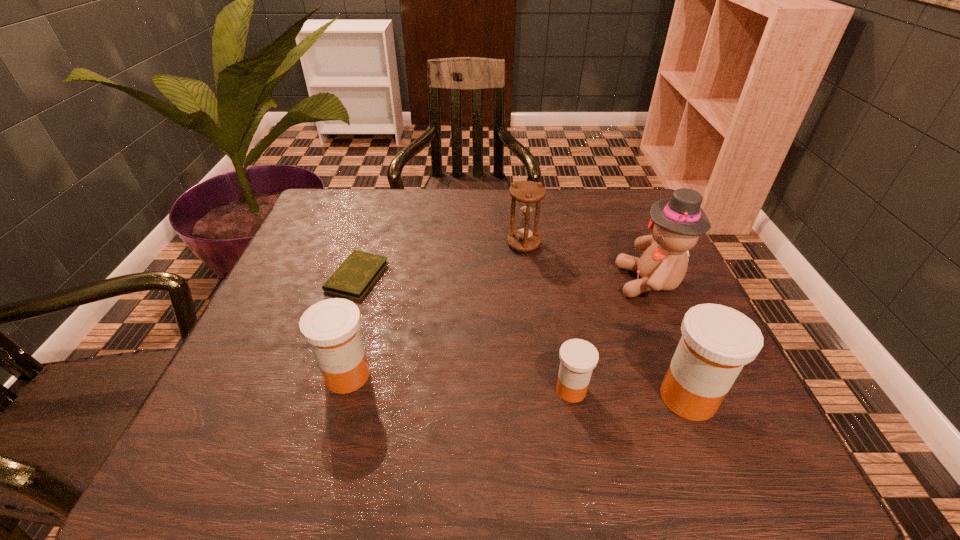
Locate an element on the screen. medicine positioned at the right edge is located at coordinates (717, 341).

The height and width of the screenshot is (540, 960). I want to click on rag_doll present at the right edge, so point(676,223).

Where is `object that is at the near right corner`? The height and width of the screenshot is (540, 960). object that is at the near right corner is located at coordinates (717, 341).

Where is `vacant space at the far edge`? The height and width of the screenshot is (540, 960). vacant space at the far edge is located at coordinates (424, 205).

The width and height of the screenshot is (960, 540). In order to click on vacant point at the near edge in this screenshot , I will do `click(462, 420)`.

The image size is (960, 540). Identify the location of vacant space at the left edge of the desktop. (284, 357).

You are a GUI agent. You are given a task and a screenshot of the screen. Output one action in this format:
    pyautogui.click(x=<x>, y=<y>)
    Task: Click on the free spot at the right edge of the desktop
    
    Given the screenshot: What is the action you would take?
    pyautogui.click(x=657, y=321)

Where is `blank space at the far left corner of the desktop`? blank space at the far left corner of the desktop is located at coordinates (324, 193).

Locate an element on the screen. The height and width of the screenshot is (540, 960). vacant space at the near left corner of the desktop is located at coordinates (311, 386).

At what (x,y) coordinates should I click in order to perform the action: click on vacant space at the near right corner of the desktop. Please return your answer as a coordinate pair (x, y). Looking at the image, I should click on (660, 382).